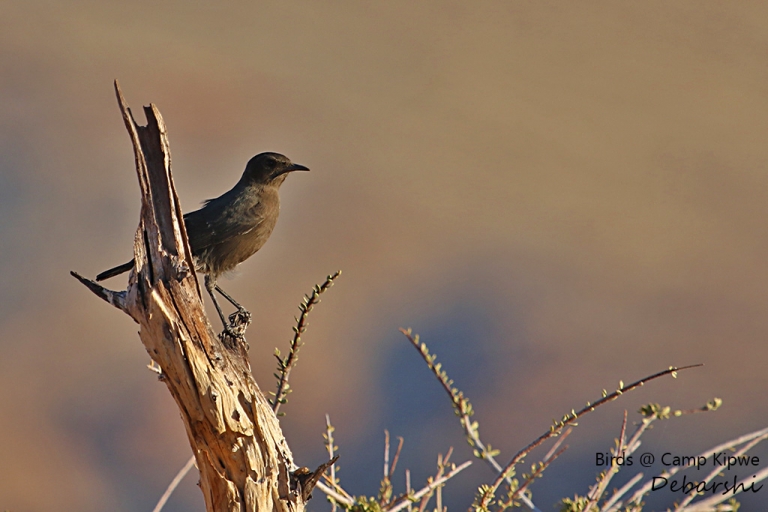
Locate an element on the screen. This screenshot has height=512, width=768. plant is located at coordinates (306, 314).